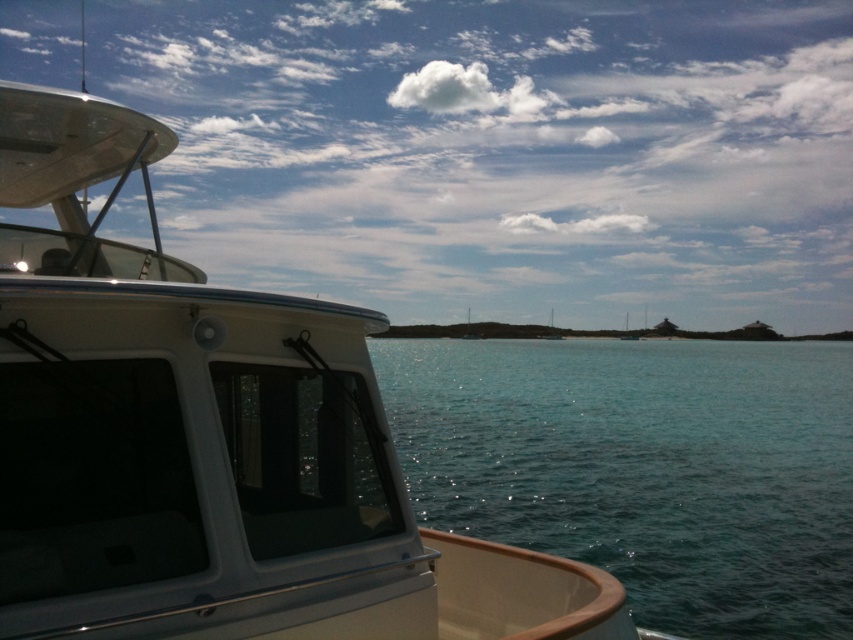
Question: Can you confirm if white glossy boat at left is positioned above clear blue water at center?

Choices:
 (A) no
 (B) yes

Answer: (B)

Question: Among these points, which one is farthest from the camera?

Choices:
 (A) (613, 403)
 (B) (689, 177)

Answer: (B)

Question: Is white glossy boat at left smaller than clear blue water at center?

Choices:
 (A) no
 (B) yes

Answer: (A)

Question: Is white glossy boat at left to the right of clear blue water at center from the viewer's perspective?

Choices:
 (A) no
 (B) yes

Answer: (A)